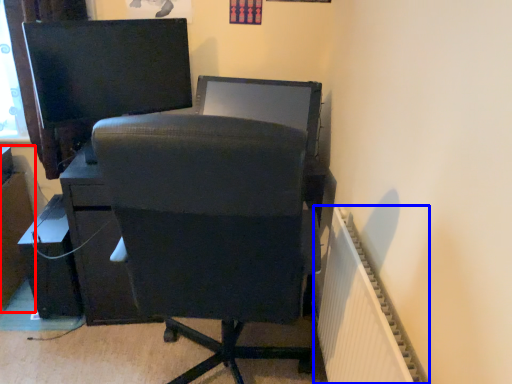
Question: Which of the following is the closest to the observer, file cabinet (highlighted by a red box) or radiator (highlighted by a blue box)?

Choices:
 (A) file cabinet
 (B) radiator

Answer: (B)